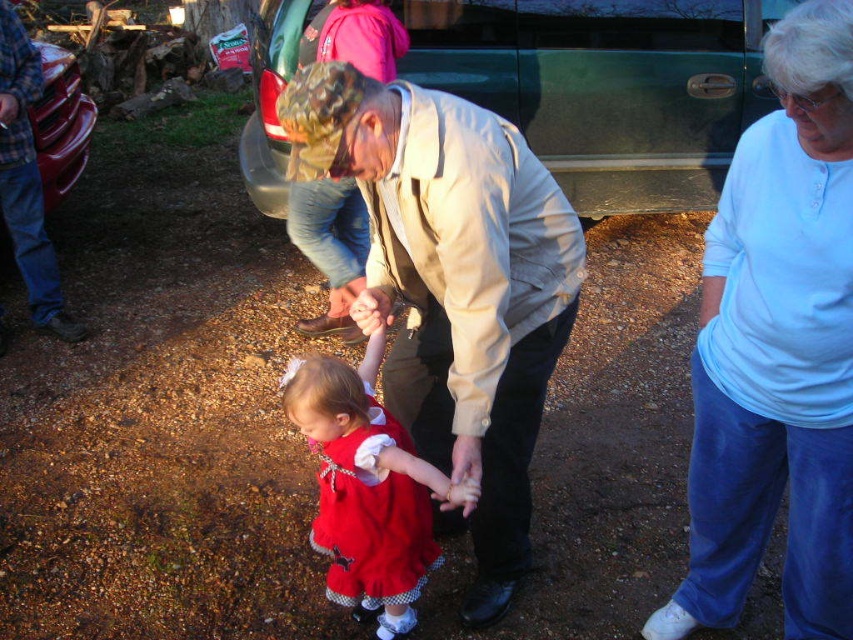
Question: Where is light beige jacket at center located in relation to brushed metal bumper at left in the image?

Choices:
 (A) right
 (B) left

Answer: (A)

Question: Among these objects, which one is farthest from the camera?

Choices:
 (A) brushed metal bumper at left
 (B) matte red dress at center
 (C) white cotton shirt at right

Answer: (A)

Question: Can you confirm if white cotton shirt at right is smaller than matte red dress at center?

Choices:
 (A) yes
 (B) no

Answer: (B)

Question: Does white cotton shirt at right appear over light beige jacket at center?

Choices:
 (A) yes
 (B) no

Answer: (B)

Question: Which point is closer to the camera?

Choices:
 (A) (22, 90)
 (B) (753, 563)
 (C) (445, 401)

Answer: (B)

Question: Considering the real-world distances, which object is closest to the light beige jacket at center?

Choices:
 (A) matte red dress at center
 (B) brushed metal bumper at left
 (C) white cotton shirt at right

Answer: (A)